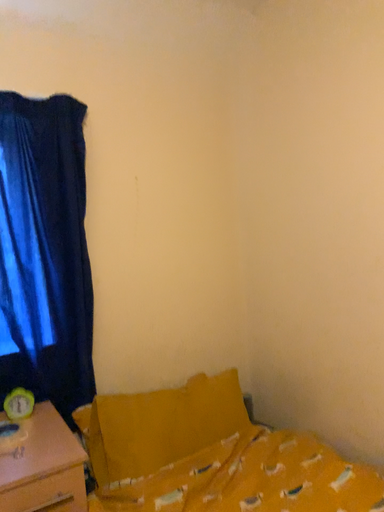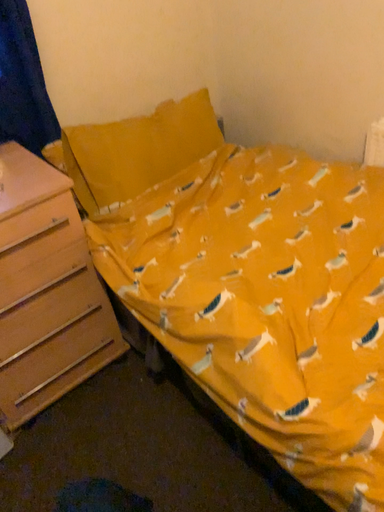
Question: How did the camera likely rotate when shooting the video?

Choices:
 (A) rotated left
 (B) rotated right

Answer: (B)